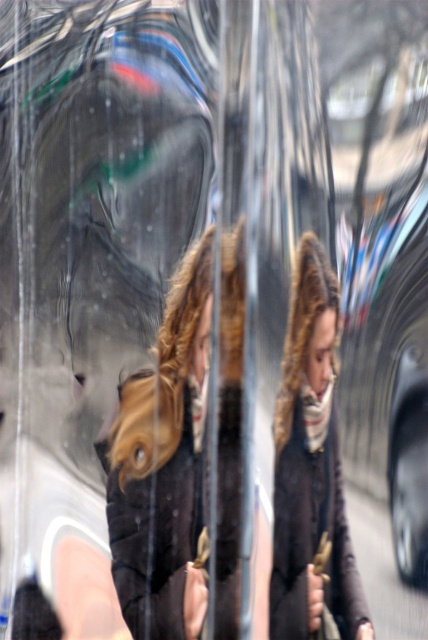
You are looking through a reflective window and see two points in the reflection. The first point is at coordinates point (190, 250) and the second is at point (312, 632). Which point is closer to you?

Point (190, 250) is further to the camera than point (312, 632), so the point closer to you is point (312, 632).

You are a fashion designer observing the image. You need to determine which garment is taller between the dark brown leather jacket at center and the dark brown wool coat at center. Which one is taller?

The dark brown leather jacket at center is much taller as the dark brown wool coat at center, so the dark brown leather jacket at center is taller.